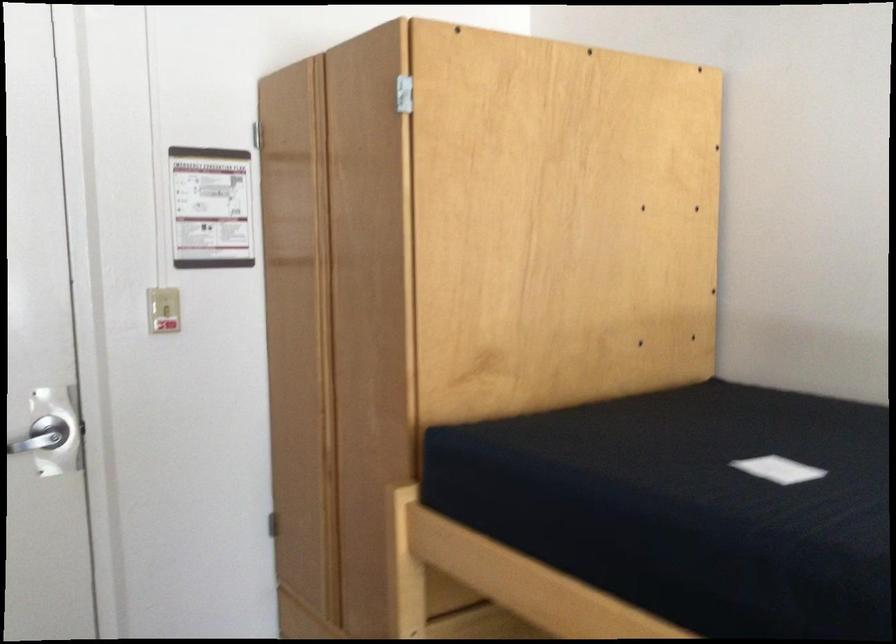
Find where to flip the light switch. Please return your answer as a coordinate pair (x, y).

(162, 308)